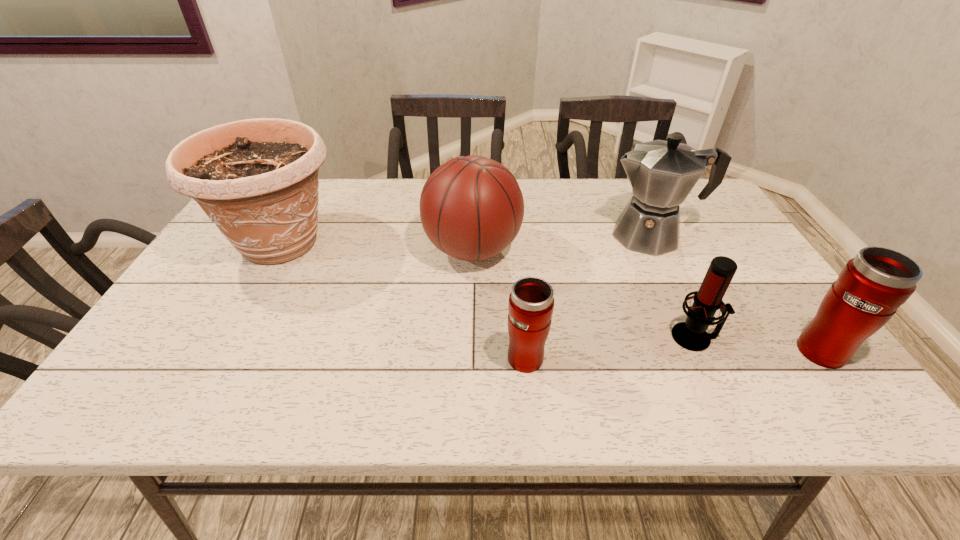
The width and height of the screenshot is (960, 540). Identify the location of the shorter thermos bottle. (531, 302).

The width and height of the screenshot is (960, 540). Identify the location of the taller thermos bottle. (870, 288).

Identify the location of the rightmost object. The image size is (960, 540). (870, 288).

Locate an element on the screen. coffeepot is located at coordinates (662, 173).

At what (x,y) coordinates should I click in order to perform the action: click on basketball. Please return your answer as a coordinate pair (x, y). Looking at the image, I should click on (471, 207).

Find the location of a particular element. Image resolution: width=960 pixels, height=540 pixels. flowerpot is located at coordinates (257, 179).

Identify the location of microphone. The height and width of the screenshot is (540, 960). (691, 335).

At what (x,y) coordinates should I click in order to perform the action: click on free region located on the side with the handle of the left thermos bottle. Please return your answer as a coordinate pair (x, y). Looking at the image, I should click on coord(519,281).

Identify the location of free location located 0.250m on the side with the handle of the left thermos bottle. (518, 266).

At what (x,y) coordinates should I click in order to perform the action: click on blank space located 0.060m on the side with the handle of the left thermos bottle. Please return your answer as a coordinate pair (x, y). Looking at the image, I should click on (523, 319).